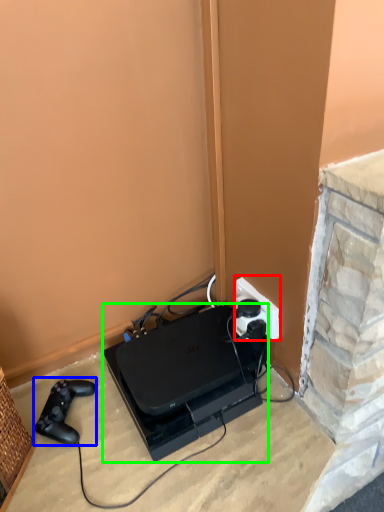
Question: Estimate the real-world distances between objects in this image. Which object is closer to power plugs and sockets (highlighted by a red box), game controller (highlighted by a blue box) or appliance (highlighted by a green box)?

Choices:
 (A) game controller
 (B) appliance

Answer: (B)